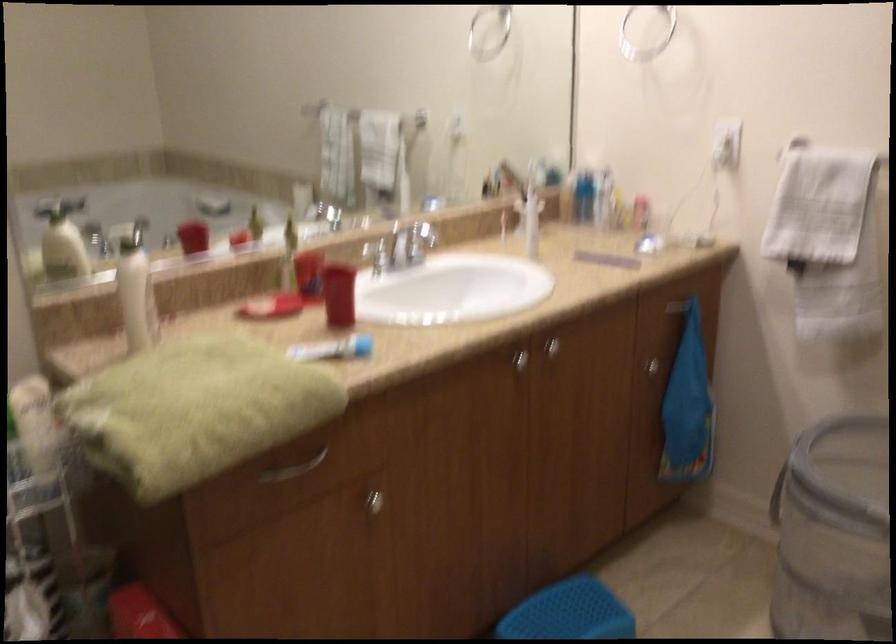
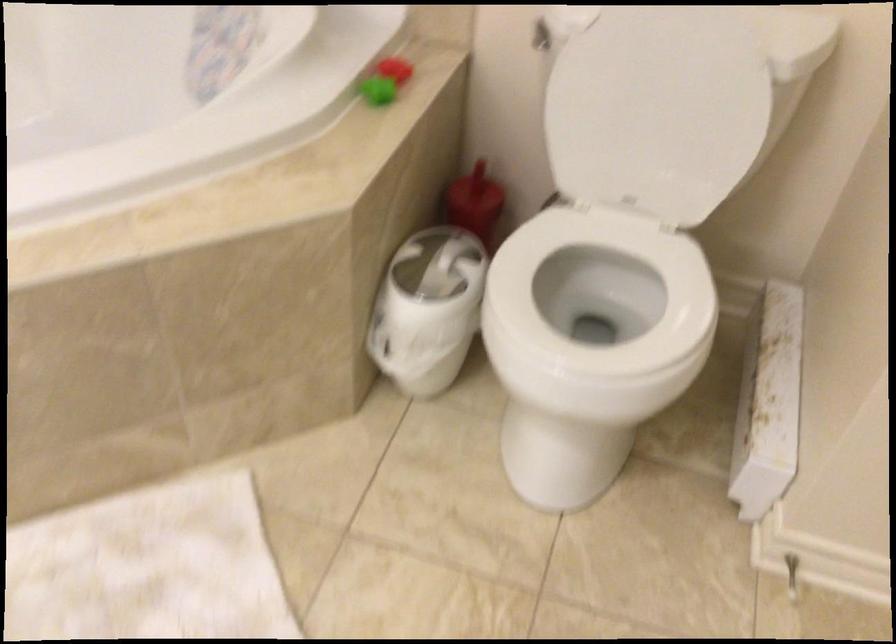
Based on the photo, first-person continuous shooting, in which direction is the camera rotating?

The camera rotated toward right-down.